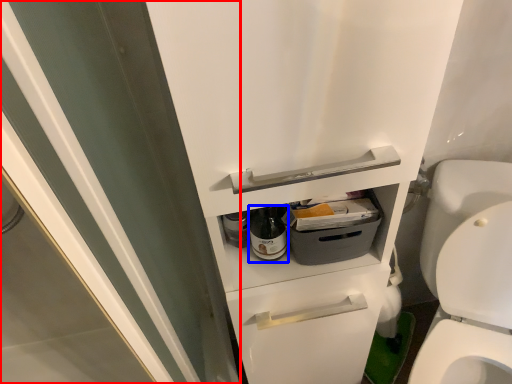
Question: Among these objects, which one is nearest to the camera, screen door (highlighted by a red box) or bottle (highlighted by a blue box)?

Choices:
 (A) screen door
 (B) bottle

Answer: (A)